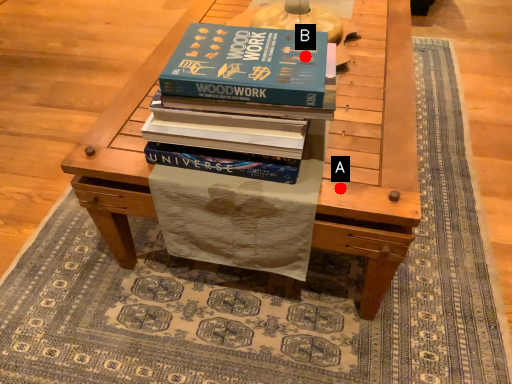
Question: Two points are circled on the image, labeled by A and B beside each circle. Which point is closer to the camera taking this photo?

Choices:
 (A) A is closer
 (B) B is closer

Answer: (B)